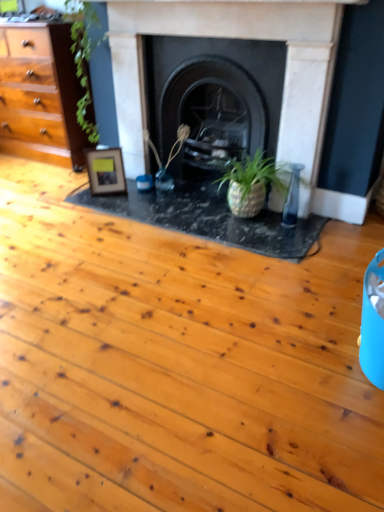
Question: Is marble fireplace at center, which ranks as the 1th fireplace in left-to-right order, taller or shorter than black stone fireplace at center, arranged as the first fireplace when viewed from the right?

Choices:
 (A) short
 (B) tall

Answer: (B)

Question: Would you say marble fireplace at center, the second fireplace in the right-to-left sequence, is to the left or to the right of black stone fireplace at center, the 2th fireplace when ordered from left to right, in the picture?

Choices:
 (A) right
 (B) left

Answer: (B)

Question: Estimate the real-world distances between objects in this image. Which object is farther from the green matte plant at center?

Choices:
 (A) marble fireplace at center, the second fireplace in the right-to-left sequence
 (B) black stone fireplace at center, arranged as the first fireplace when viewed from the right
 (C) wooden photo frame at center left

Answer: (A)

Question: Based on their relative distances, which object is nearer to the black stone fireplace at center, the 2th fireplace when ordered from left to right?

Choices:
 (A) marble fireplace at center, which ranks as the 1th fireplace in left-to-right order
 (B) wooden photo frame at center left
 (C) green matte plant at center

Answer: (A)